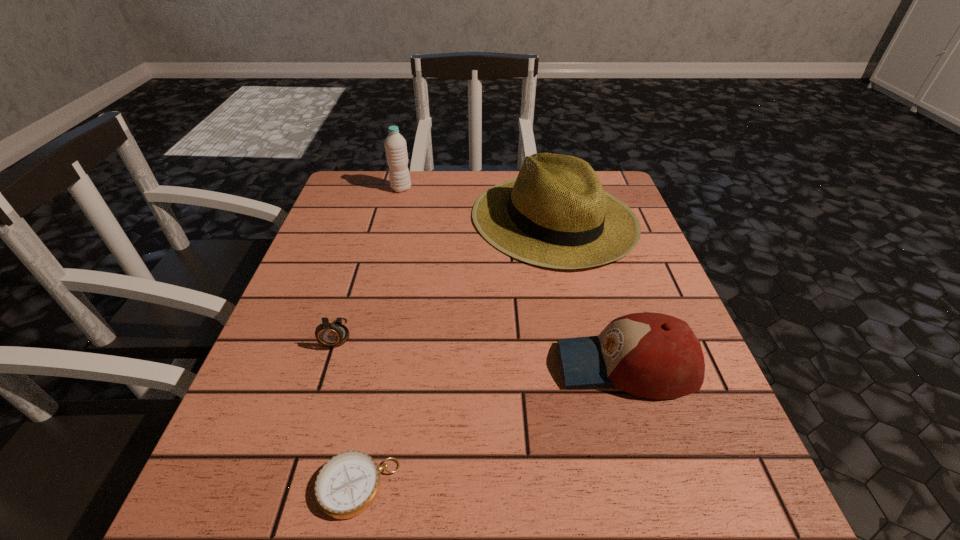
This screenshot has height=540, width=960. Identify the location of free area in between the taller compass and the nearer compass. (348, 410).

You are a GUI agent. You are given a task and a screenshot of the screen. Output one action in this format:
    pyautogui.click(x=<x>, y=<y>)
    Task: Click on the free space between the second tallest object and the nearer compass
    This screenshot has width=960, height=540.
    Given the screenshot: What is the action you would take?
    pyautogui.click(x=456, y=353)

Find the location of a particular element. free space between the farther compass and the third tallest object is located at coordinates (482, 350).

Locate an element on the screen. The width and height of the screenshot is (960, 540). vacant area between the taller compass and the fourth shortest object is located at coordinates (445, 276).

Identify the location of vacant area between the water bottle and the right compass. The image size is (960, 540). (379, 338).

Where is `free space between the tallest object and the farther compass`? The width and height of the screenshot is (960, 540). free space between the tallest object and the farther compass is located at coordinates (370, 261).

You are a GUI agent. You are given a task and a screenshot of the screen. Output one action in this format:
    pyautogui.click(x=<x>, y=<y>)
    Task: Click on the free space between the sunhat and the nearest object
    
    Given the screenshot: What is the action you would take?
    pyautogui.click(x=456, y=353)

I want to click on free spot between the second shortest object and the tallest object, so (x=370, y=261).

Point out which object is positioned as the second nearest to the baseball cap. Please provide its 2D coordinates. Your answer should be formatted as a tuple, i.e. [(x, y)], where the tuple contains the x and y coordinates of a point satisfying the conditions above.

[(347, 485)]

Select which object is the second closest to the taller compass. Please provide its 2D coordinates. Your answer should be formatted as a tuple, i.e. [(x, y)], where the tuple contains the x and y coordinates of a point satisfying the conditions above.

[(556, 214)]